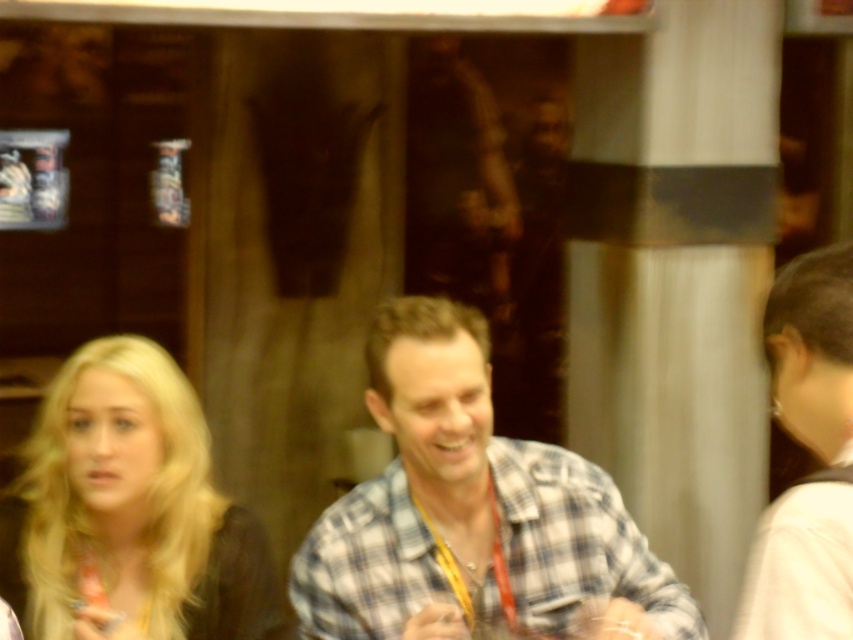
Question: In this image, where is blonde hair at center located relative to white fabric hair at right?

Choices:
 (A) right
 (B) left

Answer: (B)

Question: Is plaid fabric shirt at center bigger than white fabric hair at right?

Choices:
 (A) yes
 (B) no

Answer: (A)

Question: Which point is farther from the camera taking this photo?

Choices:
 (A) (30, 499)
 (B) (489, 573)

Answer: (A)

Question: Can you confirm if plaid fabric shirt at center is thinner than blonde hair at center?

Choices:
 (A) no
 (B) yes

Answer: (A)

Question: Which point appears farthest from the camera in this image?

Choices:
 (A) (453, 618)
 (B) (195, 518)
 (C) (758, 616)

Answer: (B)

Question: Estimate the real-world distances between objects in this image. Which object is closer to the white fabric hair at right?

Choices:
 (A) blonde hair at center
 (B) plaid fabric shirt at center

Answer: (B)